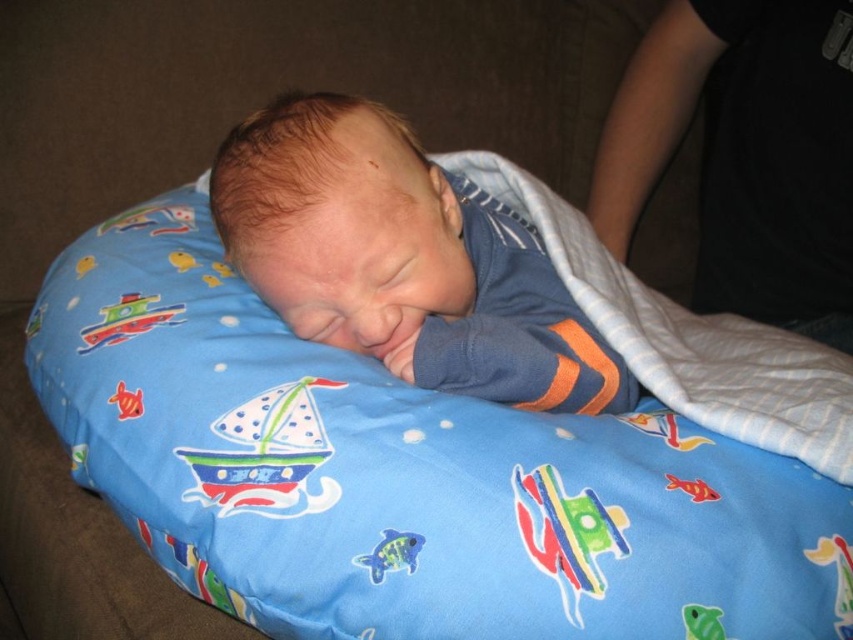
Is black cotton sleeve at upper right positioned in front of blue soft fabric at center?

No, it is behind blue soft fabric at center.

Where is `black cotton sleeve at upper right`? This screenshot has height=640, width=853. black cotton sleeve at upper right is located at coordinates (746, 154).

Is point (728, 84) more distant than point (607, 257)?

Yes, point (728, 84) is farther from viewer.

At what (x,y) coordinates should I click in order to perform the action: click on black cotton sleeve at upper right. Please return your answer as a coordinate pair (x, y). The image size is (853, 640). Looking at the image, I should click on (746, 154).

Is blue soft fabric baby at center smaller than black cotton sleeve at upper right?

Indeed, blue soft fabric baby at center has a smaller size compared to black cotton sleeve at upper right.

Does blue soft fabric baby at center lie behind black cotton sleeve at upper right?

That is False.

Does point (509, 269) come in front of point (749, 161)?

Yes, it is.

In order to click on blue soft fabric baby at center in this screenshot , I will do `click(403, 259)`.

Between point (322, 189) and point (834, 355), which one is positioned behind?

The point (834, 355) is behind.

Which is above, blue soft fabric baby at center or blue soft fabric at center?

blue soft fabric baby at center is above.

Measure the distance between point (233, 170) and camera.

Point (233, 170) and camera are 23.54 inches apart from each other.

Locate an element on the screen. blue soft fabric baby at center is located at coordinates (403, 259).